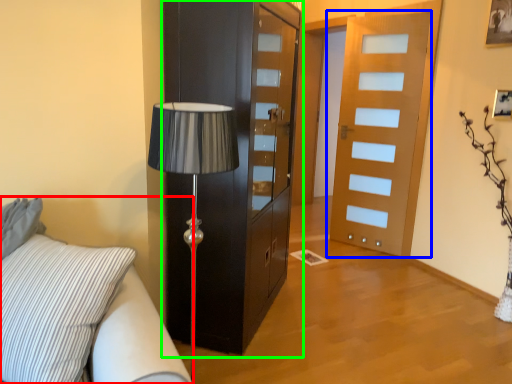
Question: Which object is positioned farthest from studio couch (highlighted by a red box)? Select from door (highlighted by a blue box) and cabinetry (highlighted by a green box).

Choices:
 (A) door
 (B) cabinetry

Answer: (A)